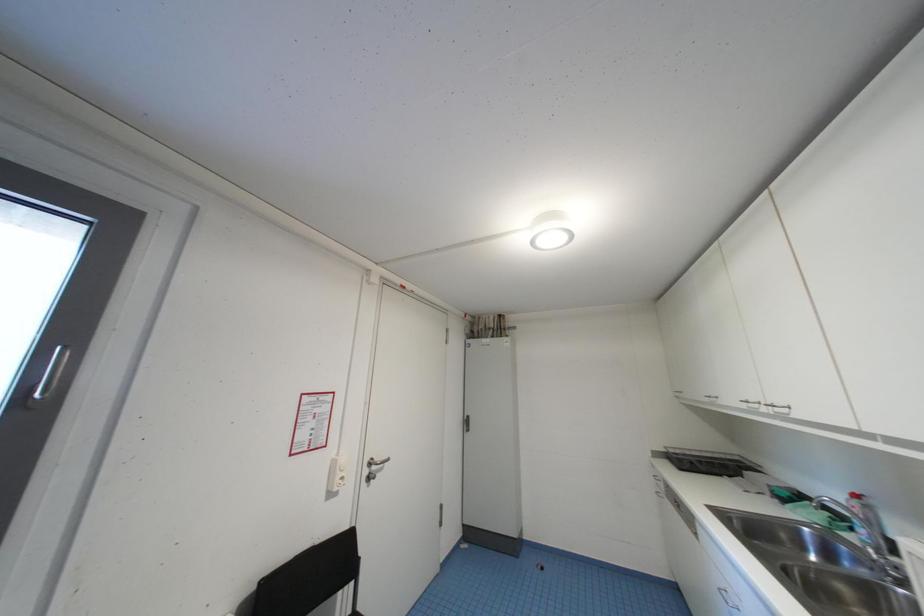
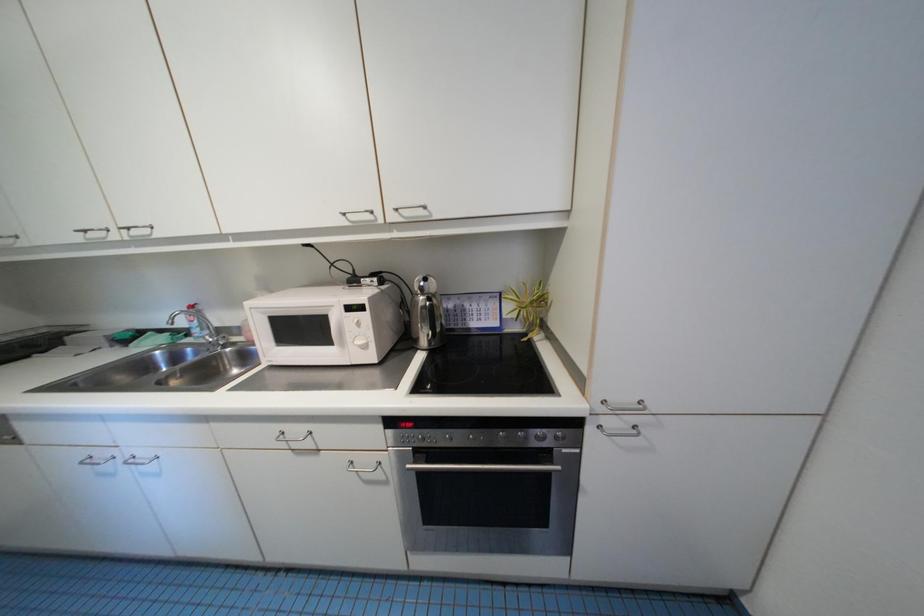
Question: The camera is either moving clockwise (left) or counter-clockwise (right) around the object. The first image is from the beginning of the video and the second image is from the end. Is the camera moving left or right when shooting the video?

Choices:
 (A) Left
 (B) Right

Answer: (A)